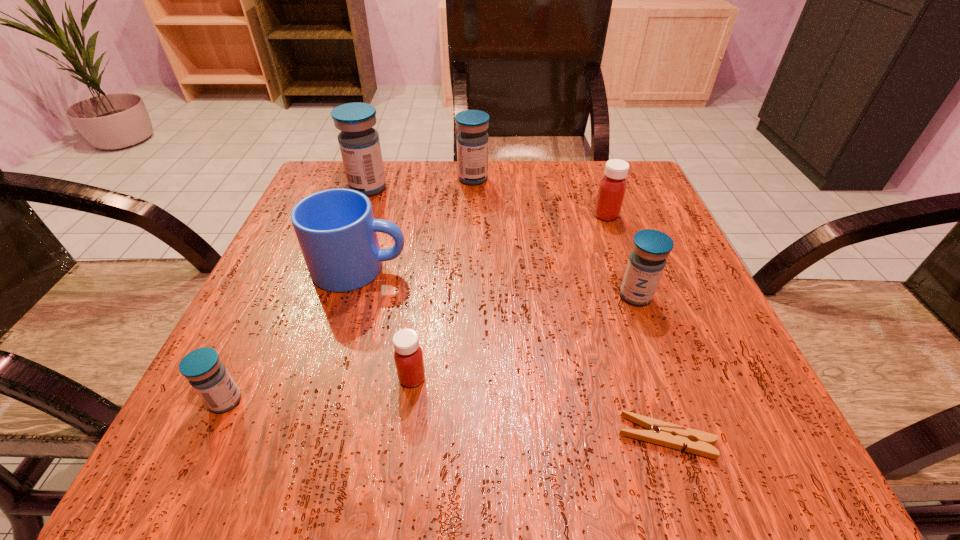
The width and height of the screenshot is (960, 540). I want to click on the fifth medicine from right to left, so click(359, 143).

The image size is (960, 540). What are the coordinates of `the biggest blue medicine` in the screenshot? It's located at (359, 143).

I want to click on the second tallest medicine, so click(x=472, y=141).

Find the location of a particular element. The width and height of the screenshot is (960, 540). the fourth object from right to left is located at coordinates (472, 141).

Where is `mug`? Image resolution: width=960 pixels, height=540 pixels. mug is located at coordinates (337, 232).

Locate an element on the screen. Image resolution: width=960 pixels, height=540 pixels. the third nearest medicine is located at coordinates (646, 263).

This screenshot has height=540, width=960. Find the location of `the second smallest blue medicine`. the second smallest blue medicine is located at coordinates (646, 263).

Locate an element on the screen. Image resolution: width=960 pixels, height=540 pixels. the third farthest medicine is located at coordinates (612, 188).

This screenshot has height=540, width=960. What are the coordinates of `the farther red medicine` in the screenshot? It's located at (612, 188).

Where is `the smaller red medicine`? This screenshot has height=540, width=960. the smaller red medicine is located at coordinates (408, 356).